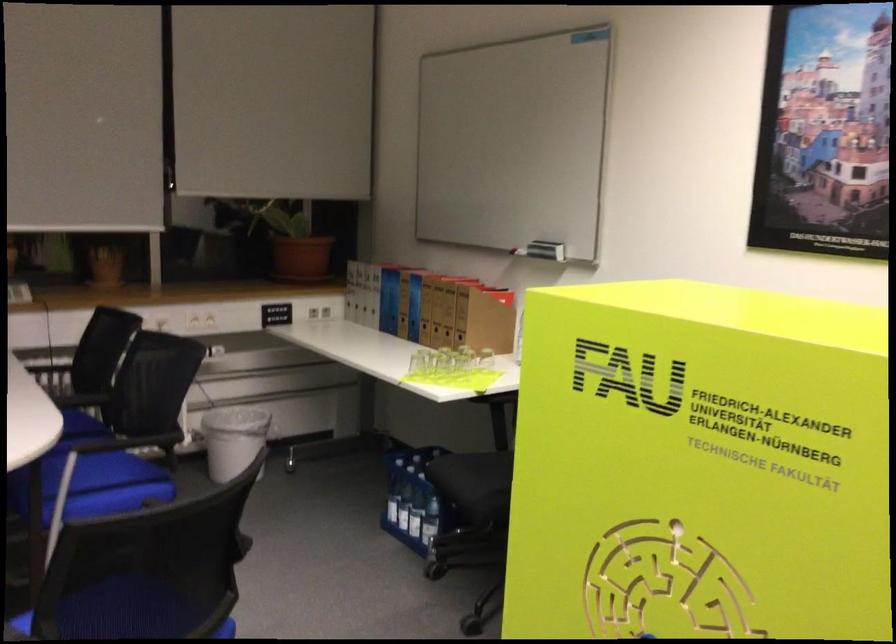
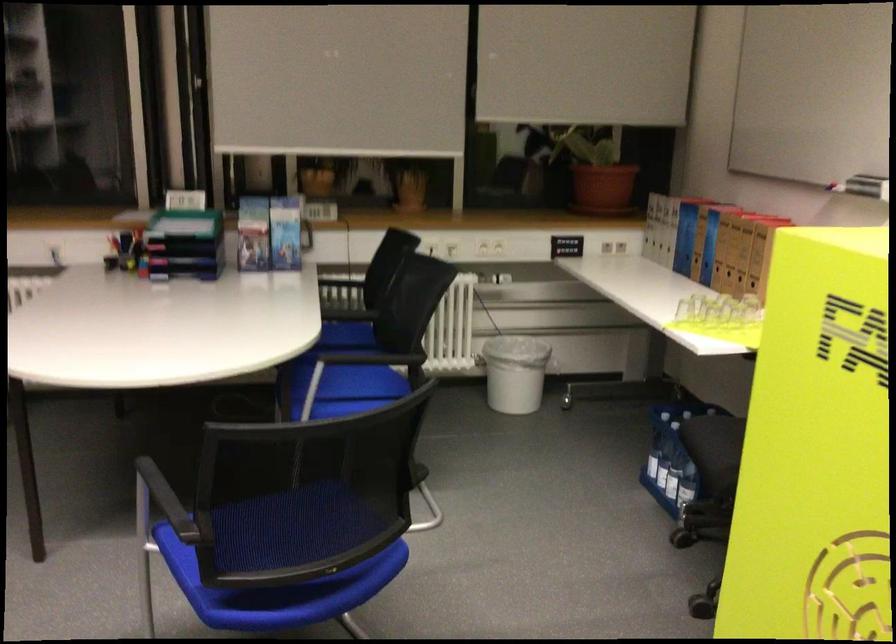
Where in the second image is the point corresponding to (409,516) from the first image?

(667, 471)